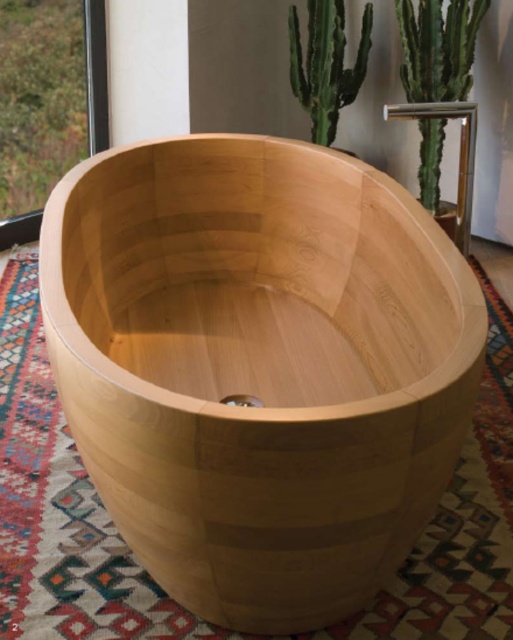
Question: Can you confirm if natural wood bathtub at center is wider than green textured cactus at upper right?

Choices:
 (A) yes
 (B) no

Answer: (A)

Question: Is natural wood bathtub at center bigger than green smooth cactus at upper right?

Choices:
 (A) no
 (B) yes

Answer: (B)

Question: Is natural wood bathtub at center thinner than green smooth cactus at upper right?

Choices:
 (A) no
 (B) yes

Answer: (A)

Question: Which of the following is the closest to the observer?

Choices:
 (A) green textured cactus at upper right
 (B) natural wood bathtub at center

Answer: (B)

Question: Among these points, which one is farthest from the camera?

Choices:
 (A) (313, 4)
 (B) (97, 449)

Answer: (A)

Question: Which point is farther from the camera taking this photo?

Choices:
 (A) (317, 109)
 (B) (228, 282)
 (C) (437, 189)

Answer: (C)